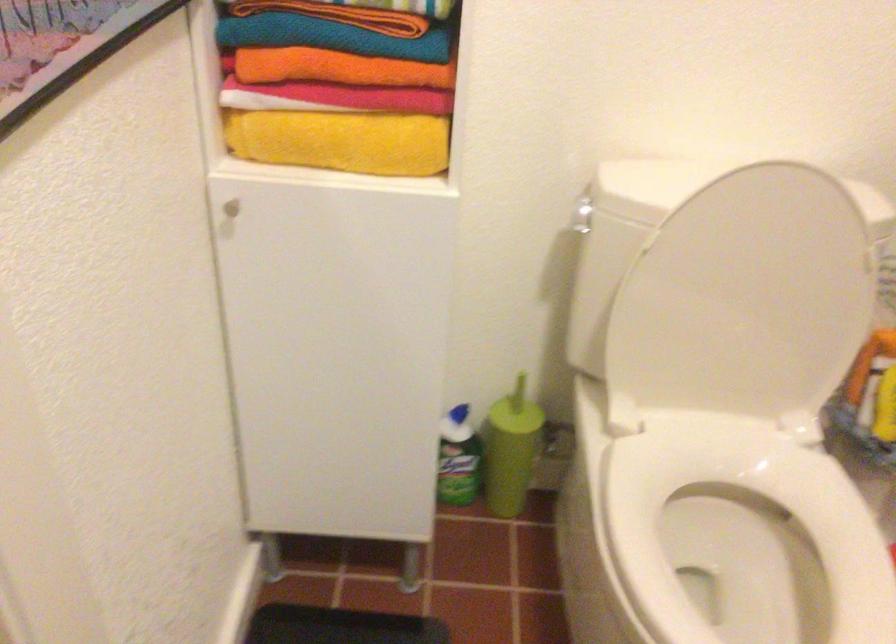
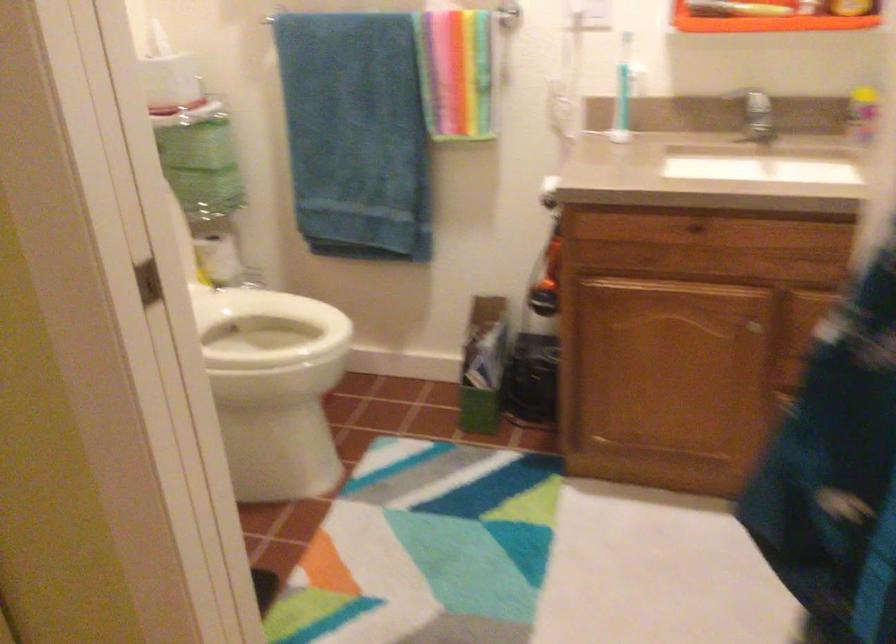
Question: I am providing you with two images of the same scene from different viewpoints. After the viewpoint changes to image2, which objects are now occluded?

Choices:
 (A) toilet paper roll
 (B) blue toothbrush
 (C) white toilet seat
 (D) small metal trashcan

Answer: (C)